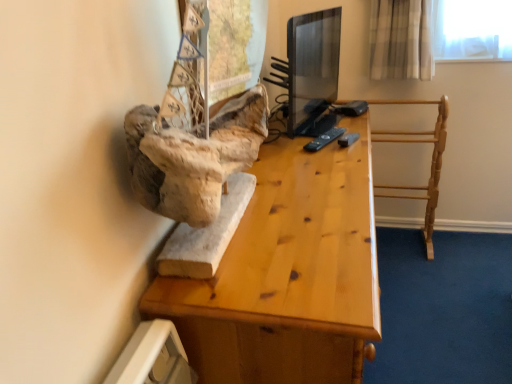
Where is `vacant point to the right of black plastic remote at center`? vacant point to the right of black plastic remote at center is located at coordinates pyautogui.click(x=355, y=134).